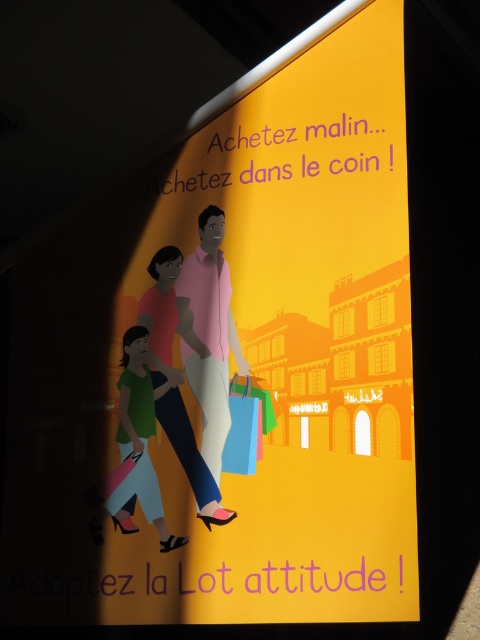
Looking at the advertisement, you see a matte pink dress at center and a blue fabric shopping bag at center. Which object is positioned to the left?

The matte pink dress at center is to the left of the blue fabric shopping bag at center.